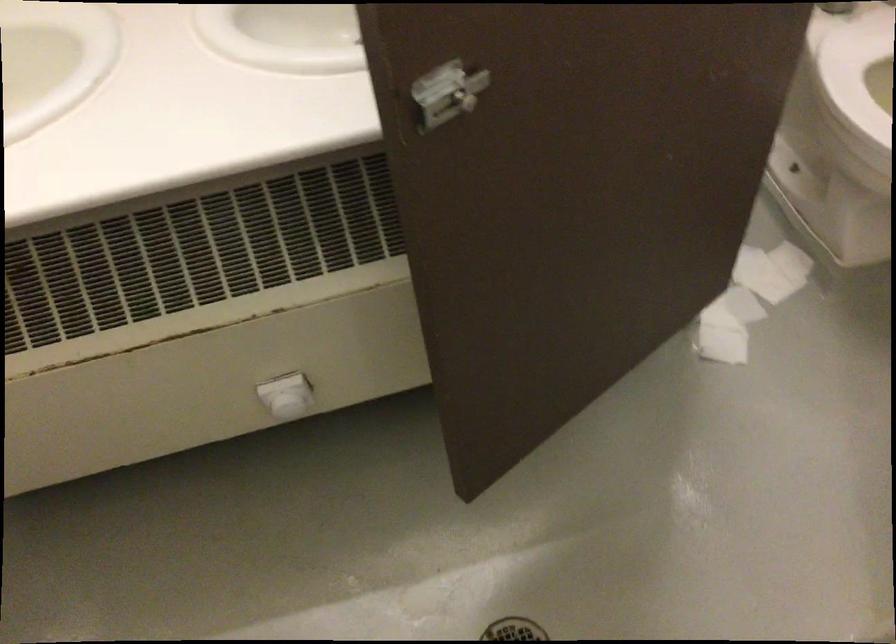
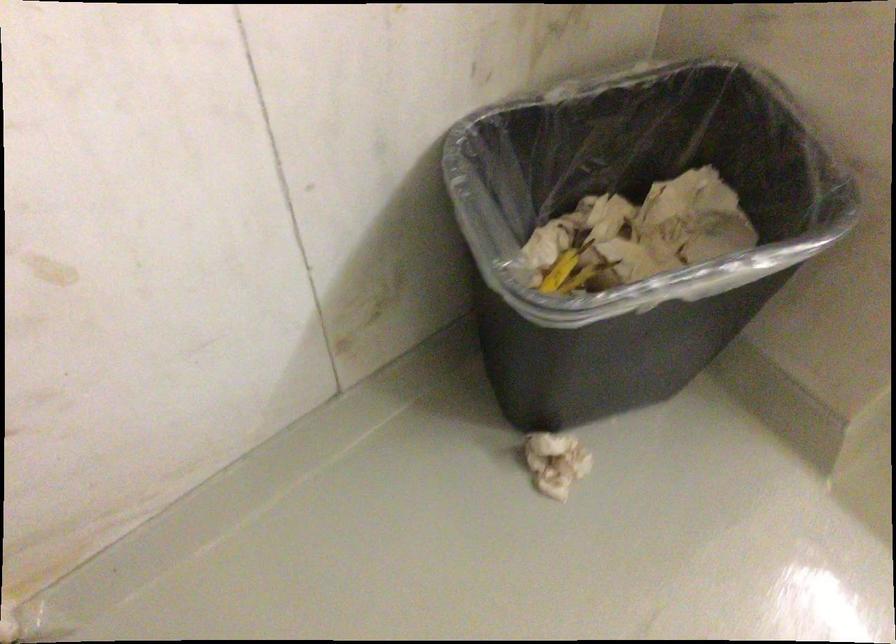
The first image is from the beginning of the video and the second image is from the end. How did the camera likely rotate when shooting the video?

The rotation direction of the camera is left-down.